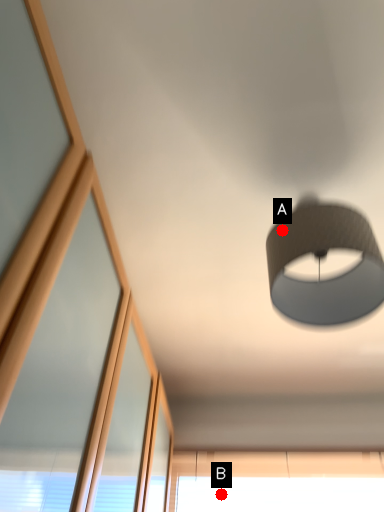
Question: Two points are circled on the image, labeled by A and B beside each circle. Among these points, which one is farthest from the camera?

Choices:
 (A) A is further
 (B) B is further

Answer: (B)